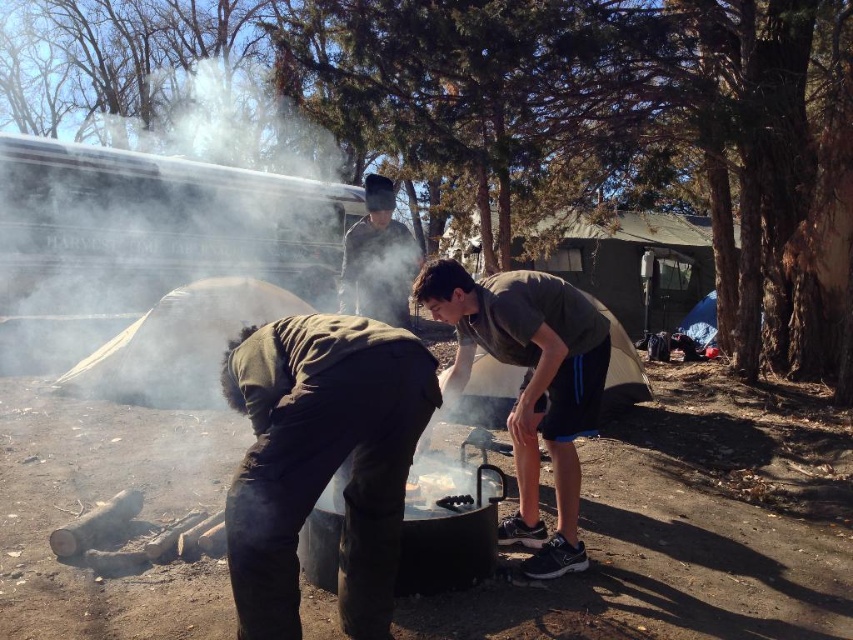
Question: Which point is farther to the camera?

Choices:
 (A) [x=265, y=412]
 (B) [x=579, y=396]

Answer: (B)

Question: Which point is farther to the camera?

Choices:
 (A) (711, 307)
 (B) (352, 301)
 (C) (618, 339)

Answer: (A)

Question: Is white canvas tent at center above dark gray knit hat at center?

Choices:
 (A) no
 (B) yes

Answer: (A)

Question: Is dark green fabric at lower left positioned behind blue tarp at center?

Choices:
 (A) yes
 (B) no

Answer: (B)

Question: Which object is positioned farthest from the white canvas tent at center?

Choices:
 (A) dark green fabric at lower left
 (B) dark gray knit hat at center

Answer: (A)

Question: Is dark green fabric at lower left in front of dark gray fabric shirt at center?

Choices:
 (A) yes
 (B) no

Answer: (A)